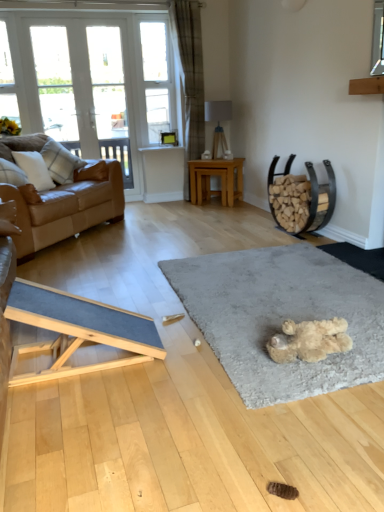
Question: From a real-world perspective, is white textured pillow at left, the 1th pillow when ordered from back to front, on top of white glass door at upper left, acting as the 3th window starting from the left?

Choices:
 (A) yes
 (B) no

Answer: (B)

Question: From the image's perspective, is white textured pillow at left, the 1th pillow when ordered from back to front, below white glass door at upper left, acting as the 3th window starting from the left?

Choices:
 (A) no
 (B) yes

Answer: (B)

Question: Does white textured pillow at left, the 1th pillow when ordered from back to front, contain white glass door at upper left, arranged as the 1th window when viewed from the right?

Choices:
 (A) no
 (B) yes

Answer: (A)

Question: Is white textured pillow at left, the 1th pillow when ordered from back to front, with white glass door at upper left, arranged as the 1th window when viewed from the right?

Choices:
 (A) no
 (B) yes

Answer: (A)

Question: Is white textured pillow at left, the 1th pillow when ordered from back to front, shorter than white glass door at upper left, arranged as the 1th window when viewed from the right?

Choices:
 (A) no
 (B) yes

Answer: (B)

Question: From a real-world perspective, is white textured pillow at left, the 2th pillow viewed from the front, under white glass door at upper left, acting as the 3th window starting from the left?

Choices:
 (A) no
 (B) yes

Answer: (B)

Question: From a real-world perspective, is white glass window at upper left, the 1th window positioned from the left, positioned over clear glass window screen at upper center based on gravity?

Choices:
 (A) no
 (B) yes

Answer: (B)

Question: Is white glass window at upper left, the 1th window positioned from the left, outside of clear glass window screen at upper center?

Choices:
 (A) yes
 (B) no

Answer: (A)

Question: Can you confirm if white glass window at upper left, the third window viewed from the right, is positioned to the right of clear glass window screen at upper center?

Choices:
 (A) yes
 (B) no

Answer: (B)

Question: Is white glass window at upper left, the third window viewed from the right, to the left of clear glass window screen at upper center from the viewer's perspective?

Choices:
 (A) no
 (B) yes

Answer: (B)

Question: Is white glass window at upper left, the 1th window positioned from the left, wider than clear glass window screen at upper center?

Choices:
 (A) no
 (B) yes

Answer: (A)

Question: From a real-world perspective, is white glass window at upper left, the 1th window positioned from the left, located beneath clear glass window screen at upper center?

Choices:
 (A) yes
 (B) no

Answer: (B)

Question: Considering the relative positions of white glass door at upper left, acting as the 3th window starting from the left, and white glass door at upper left, marked as the second window in a left-to-right arrangement, in the image provided, is white glass door at upper left, acting as the 3th window starting from the left, to the right of white glass door at upper left, marked as the second window in a left-to-right arrangement, from the viewer's perspective?

Choices:
 (A) yes
 (B) no

Answer: (A)